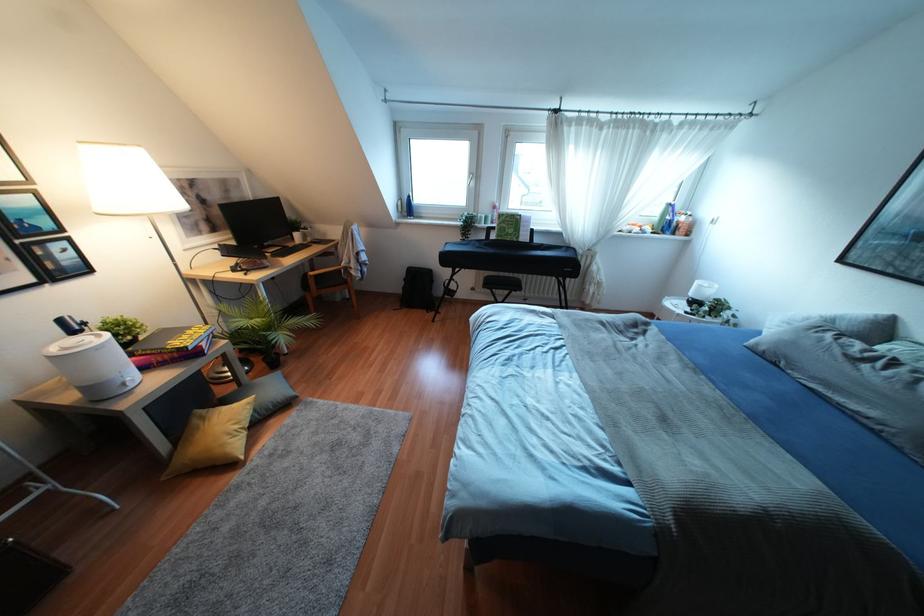
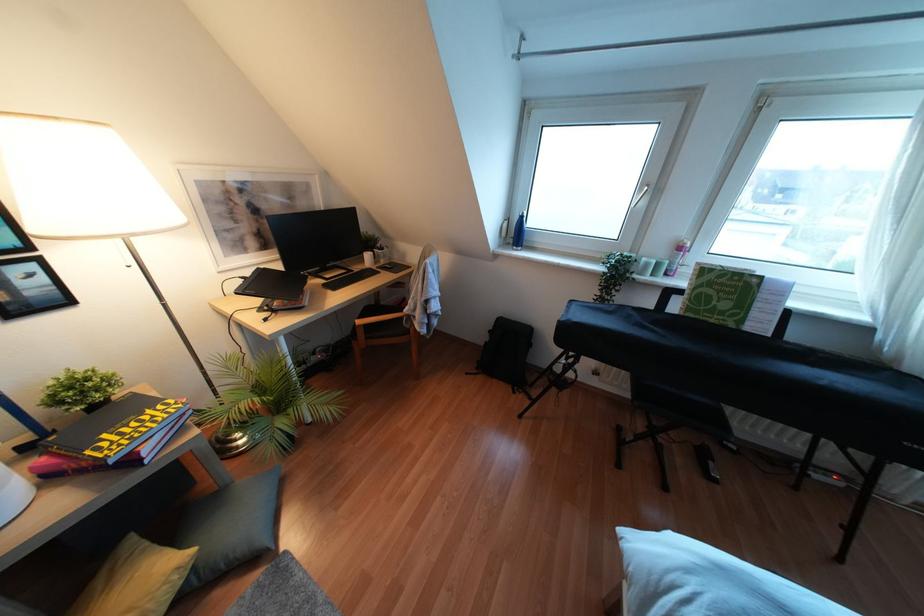
Question: What movement of the cameraman would produce the second image?

Choices:
 (A) Left
 (B) Right
 (C) Forward
 (D) Backward

Answer: (C)